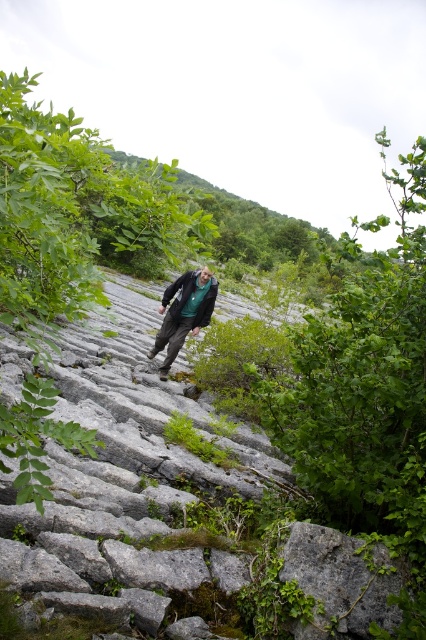
Can you confirm if dark green fabric jacket at center is shorter than dark green textured jacket at center?

No, dark green fabric jacket at center is not shorter than dark green textured jacket at center.

Which is in front, point (161, 365) or point (180, 301)?

Positioned in front is point (180, 301).

Image resolution: width=426 pixels, height=640 pixels. What are the coordinates of `dark green fabric jacket at center` in the screenshot? It's located at (184, 312).

Which is behind, point (16, 548) or point (210, 282)?

Point (210, 282)

At what (x,y) coordinates should I click in order to perform the action: click on gray rough stone at center. Please return your answer as a coordinate pair (x, y). Looking at the image, I should click on (190, 515).

This screenshot has width=426, height=640. What do you see at coordinates (190, 515) in the screenshot? I see `gray rough stone at center` at bounding box center [190, 515].

The image size is (426, 640). What are the coordinates of `gray rough stone at center` in the screenshot? It's located at (190, 515).

Does gray rough stone at center have a lesser width compared to dark green textured jacket at center?

In fact, gray rough stone at center might be wider than dark green textured jacket at center.

Between point (123, 497) and point (210, 307), which one is positioned in front?

Point (123, 497) is in front.

Where is `gray rough stone at center`? Image resolution: width=426 pixels, height=640 pixels. gray rough stone at center is located at coordinates (190, 515).